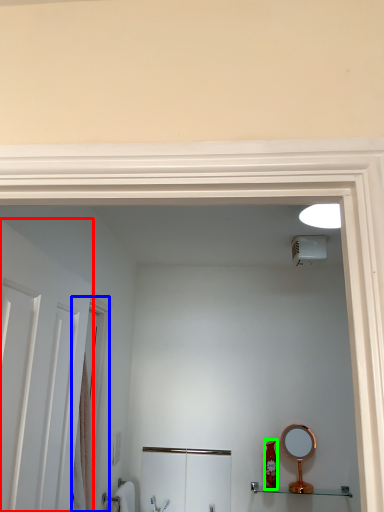
Question: Which object is positioned closest to door (highlighted by a red box)? Select from screen door (highlighted by a blue box) and toiletry (highlighted by a green box).

Choices:
 (A) screen door
 (B) toiletry

Answer: (A)